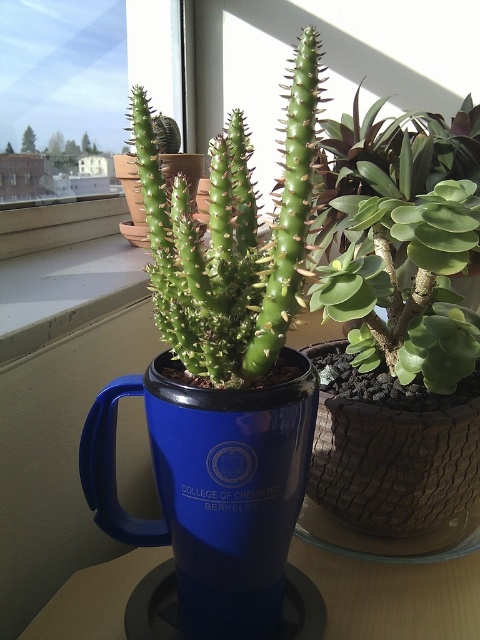
You are a delivery robot with a 4.5 inch wide package. You need to place the package between the blue ceramic mug at center and the blue plastic table at center. Can you fit the package in that space?

The space between the blue ceramic mug at center and the blue plastic table at center is 5.00 inches. Since the package is 4.5 inches wide, it can fit in the space as there is enough room.

You are arranging plants on a desk and have a blue ceramic mug at center and a blue plastic table at center. Which object should you move to the right to make space for a new plant on the left side?

You should move the blue plastic table at center to the right because the blue ceramic mug at center is already to the left of it, so shifting the table would create space on the left side.